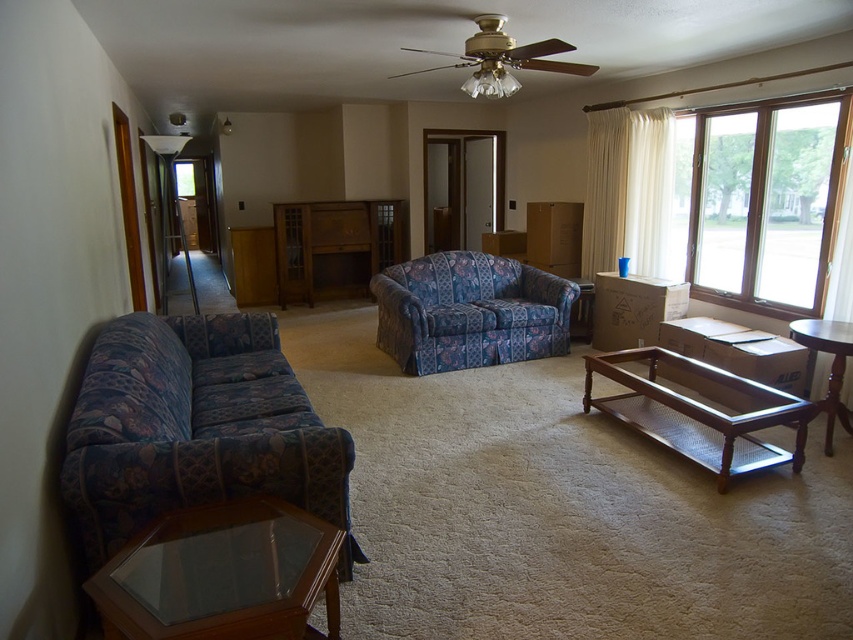
You are standing in the living room and want to take a photo of both point (181, 616) and point (801, 444). To ensure both points are in focus, should you adjust your camera to focus on the closer point or the farther point?

You should focus on the closer point, point (181, 616), because it is nearer to the camera than point (801, 444). This way, the depth of field will cover both points effectively.